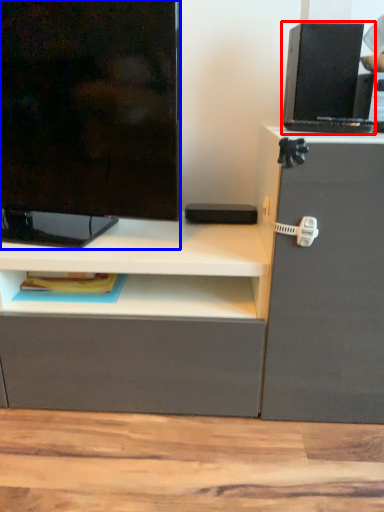
Question: Which point is closer to the camera, computer (highlighted by a red box) or television (highlighted by a blue box)?

Choices:
 (A) computer
 (B) television

Answer: (B)